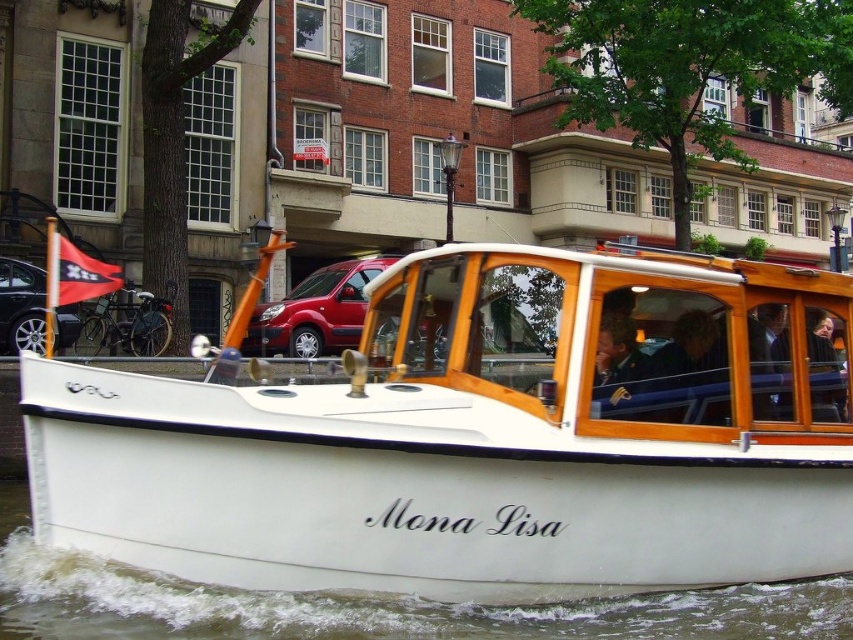
Question: Can you confirm if white polished wood boat at center is wider than white water at lower center?

Choices:
 (A) no
 (B) yes

Answer: (B)

Question: Does white polished wood boat at center have a greater width compared to green military uniform at center?

Choices:
 (A) yes
 (B) no

Answer: (A)

Question: Which point appears farthest from the camera in this image?

Choices:
 (A) (509, 566)
 (B) (630, 321)

Answer: (B)

Question: Can you confirm if white water at lower center is positioned to the right of green military uniform at center?

Choices:
 (A) yes
 (B) no

Answer: (B)

Question: Among these points, which one is nearest to the camera?

Choices:
 (A) (790, 492)
 (B) (616, 374)

Answer: (B)

Question: Which of these objects is positioned closest to the white polished wood boat at center?

Choices:
 (A) green military uniform at center
 (B) white water at lower center

Answer: (A)